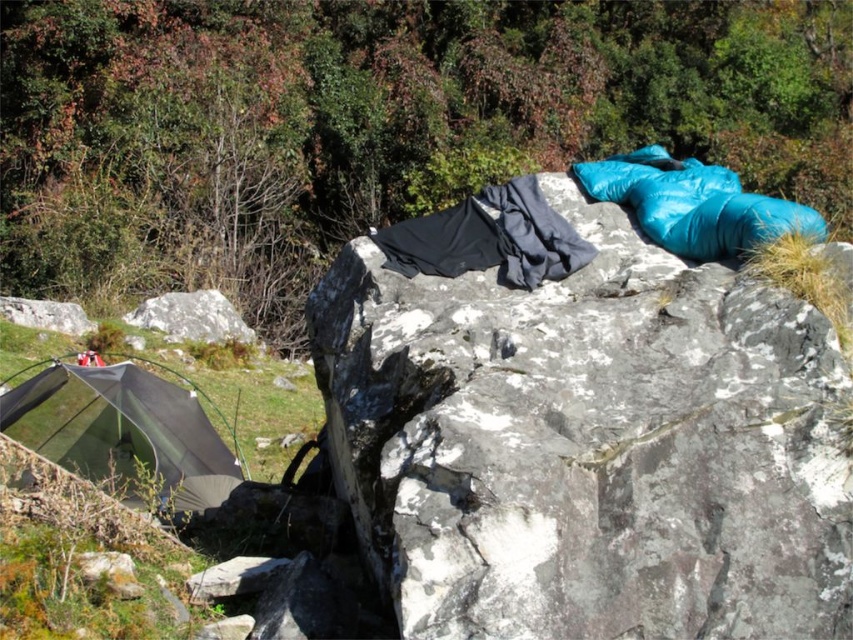
Question: Is smooth gray rock at upper center further to camera compared to matte gray tent at lower left?

Choices:
 (A) yes
 (B) no

Answer: (B)

Question: Which is farther from the matte gray tent at lower left?

Choices:
 (A) gray rough rock at lower left
 (B) smooth gray rock at upper center

Answer: (A)

Question: Which of the following is the farthest from the observer?

Choices:
 (A) matte gray tent at lower left
 (B) smooth gray rock at upper center
 (C) gray rough rock at lower left

Answer: (C)

Question: Is the position of smooth gray rock at upper center less distant than that of matte gray tent at lower left?

Choices:
 (A) yes
 (B) no

Answer: (A)

Question: Which point appears farthest from the camera in this image?

Choices:
 (A) (200, 484)
 (B) (532, 362)
 (C) (234, 332)

Answer: (C)

Question: Is smooth gray rock at upper center positioned in front of matte gray tent at lower left?

Choices:
 (A) no
 (B) yes

Answer: (B)